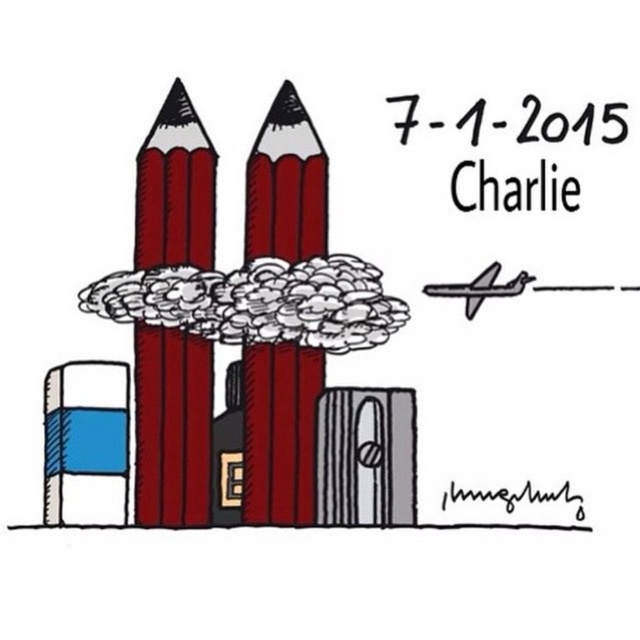
Question: Is matte red crayon at left bigger than matte red pencil at center?

Choices:
 (A) yes
 (B) no

Answer: (B)

Question: In this image, where is matte red crayon at left located relative to matte red pencil at center?

Choices:
 (A) below
 (B) above

Answer: (A)

Question: Which object appears farthest from the camera in this image?

Choices:
 (A) matte red pencil at center
 (B) matte red crayon at left

Answer: (A)

Question: Which point appears closest to the camera in this image?

Choices:
 (A) (188, 202)
 (B) (246, 468)

Answer: (B)

Question: Can you confirm if matte red crayon at left is positioned below matte red pencil at center?

Choices:
 (A) no
 (B) yes

Answer: (B)